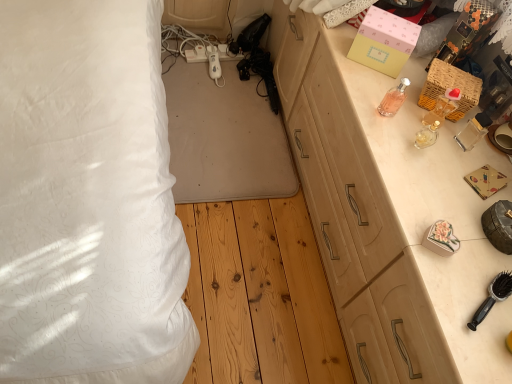
Identify the location of vacant space that is in between black plastic brush at lower right and translucent glass perfume at right, the 2th perfume viewed from the right. Image resolution: width=512 pixels, height=384 pixels. (447, 218).